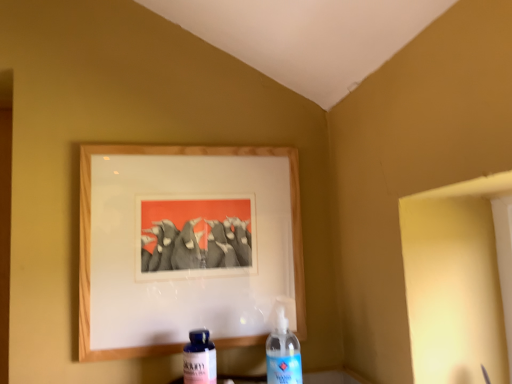
Question: In the image, is blue glass bottle at lower center, marked as the first bottle in a left-to-right arrangement, on the left side or the right side of wooden picture frame at upper center?

Choices:
 (A) left
 (B) right

Answer: (B)

Question: Considering the positions of point (195, 380) and point (302, 324), is point (195, 380) closer or farther from the camera than point (302, 324)?

Choices:
 (A) farther
 (B) closer

Answer: (B)

Question: Based on their relative distances, which object is nearer to the wooden picture frame at upper center?

Choices:
 (A) blue glass bottle at lower center, which ranks as the 2th bottle in right-to-left order
 (B) transparent plastic bottle at center, which ranks as the 2th bottle in left-to-right order

Answer: (B)

Question: Which object is the closest to the blue glass bottle at lower center, marked as the first bottle in a left-to-right arrangement?

Choices:
 (A) wooden picture frame at upper center
 (B) transparent plastic bottle at center, which ranks as the 2th bottle in left-to-right order

Answer: (B)